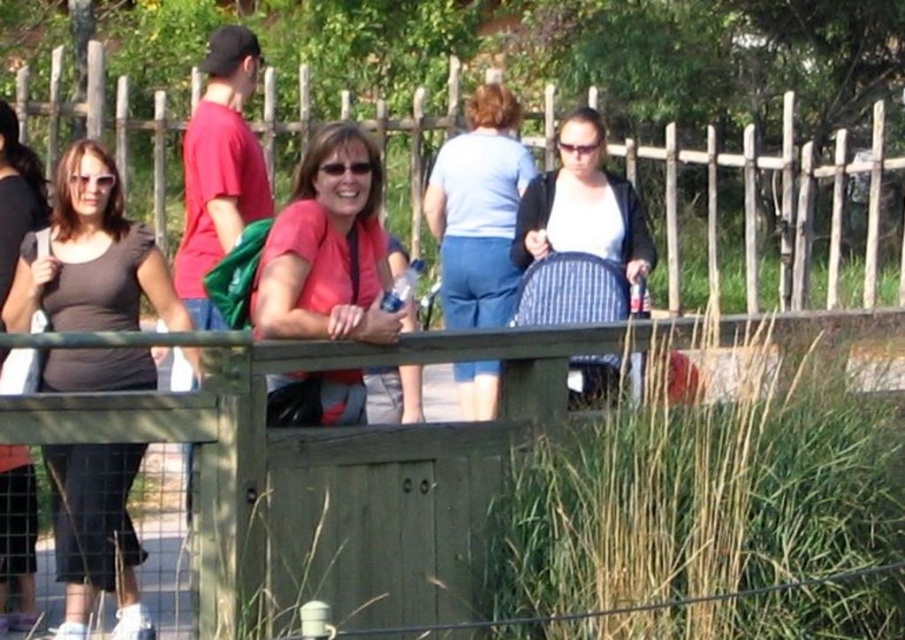
You are a photographer trying to capture a photo of the matte pink shirt at center and the striped fabric stroller at center. Since you want both subjects to appear equally prominent in the photo, which object should you zoom in on more?

The matte pink shirt at center is smaller than the striped fabric stroller at center, so you should zoom in more on the matte pink shirt at center to make it appear larger in the photo and balance its prominence with the stroller.

You are a photographer trying to capture a photo of the striped fabric stroller at center. You notice a person wearing a matte pink shirt at center is blocking your view. Based on their positions, which direction should you move to avoid the obstruction?

Since the matte pink shirt at center is to the left of the striped fabric stroller at center, you should move to the right to avoid the obstruction and get a clear view of the striped fabric stroller at center.

You are planning to take a photo of the matte black shirt at left and the matte pink shirt at center. The camera you are using has a maximum focus range of 1 meter. Can both shirts be in focus at the same time?

The matte black shirt at left is 1.07 meters from the matte pink shirt at center. Since the distance between them is slightly more than the camera can focus within 1 meter, both shirts cannot be in focus simultaneously.